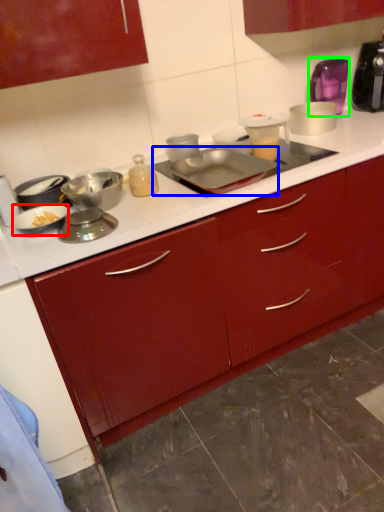
Question: Which object is the closest to the kitchen appliance (highlighted by a red box)? Choose among these: kitchen appliance (highlighted by a blue box) or appliance (highlighted by a green box).

Choices:
 (A) kitchen appliance
 (B) appliance

Answer: (A)